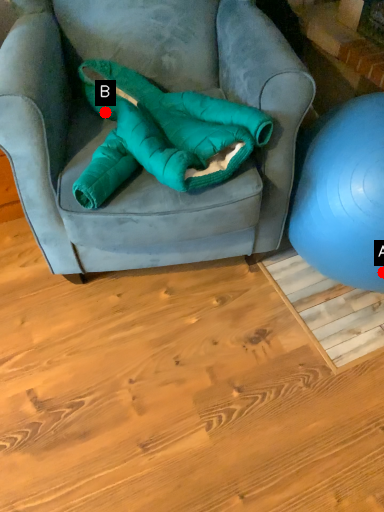
Question: Two points are circled on the image, labeled by A and B beside each circle. Which point is closer to the camera?

Choices:
 (A) A is closer
 (B) B is closer

Answer: (A)